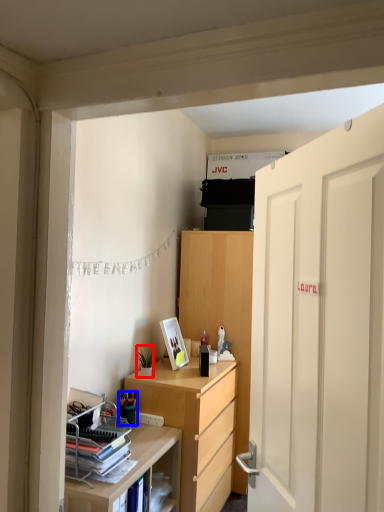
Question: Which of the following is the farthest to the observer, houseplant (highlighted by a red box) or stationery (highlighted by a blue box)?

Choices:
 (A) houseplant
 (B) stationery

Answer: (A)